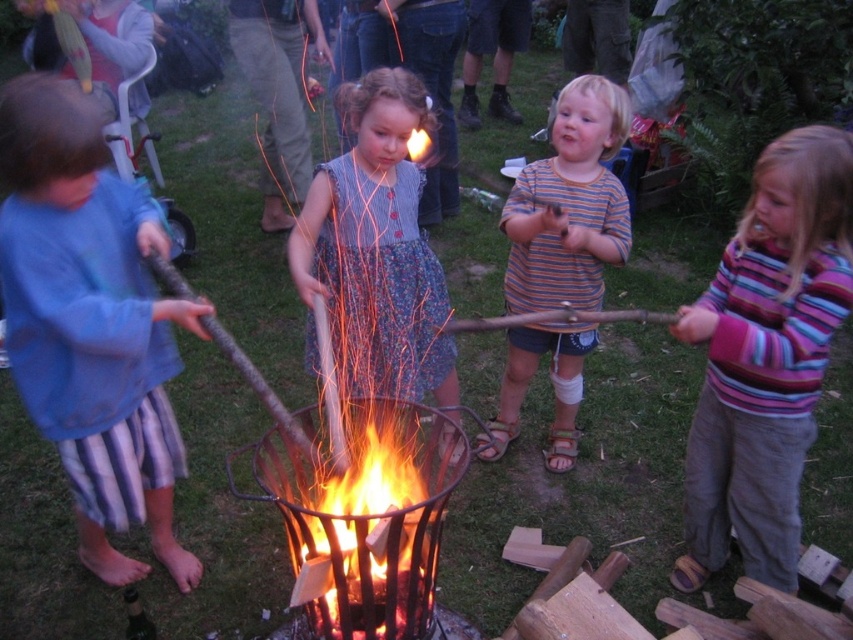
You are a parent watching the children near the fire pit. You notice the striped cotton shirt at center and the flaming wood at center. Which object is taller?

The striped cotton shirt at center is much taller than the flaming wood at center.